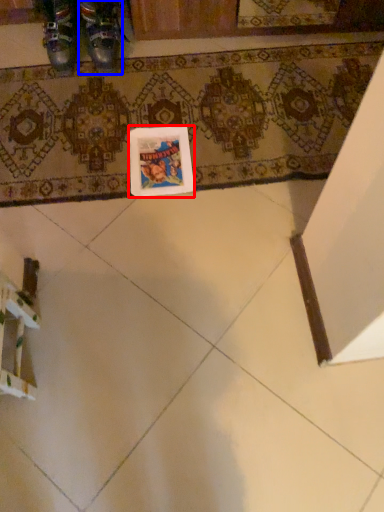
Question: Which object appears closest to the camera in this image, postcard (highlighted by a red box) or footwear (highlighted by a blue box)?

Choices:
 (A) postcard
 (B) footwear

Answer: (A)